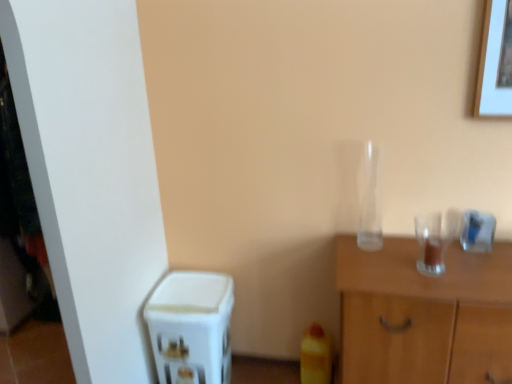
Question: Does transparent glass vase at center-right have a lesser height compared to white plastic water dispenser at lower left?

Choices:
 (A) yes
 (B) no

Answer: (A)

Question: From the image's perspective, is transparent glass vase at center-right over white plastic water dispenser at lower left?

Choices:
 (A) yes
 (B) no

Answer: (A)

Question: From a real-world perspective, is transparent glass vase at center-right over white plastic water dispenser at lower left?

Choices:
 (A) no
 (B) yes

Answer: (B)

Question: Is transparent glass vase at center-right wider than white plastic water dispenser at lower left?

Choices:
 (A) no
 (B) yes

Answer: (A)

Question: From the image's perspective, does transparent glass vase at center-right appear lower than white plastic water dispenser at lower left?

Choices:
 (A) no
 (B) yes

Answer: (A)

Question: In terms of height, does transparent glass vase at center-right look taller or shorter compared to white plastic water dispenser at lower left?

Choices:
 (A) short
 (B) tall

Answer: (A)

Question: From a real-world perspective, is transparent glass vase at center-right positioned above or below white plastic water dispenser at lower left?

Choices:
 (A) above
 (B) below

Answer: (A)

Question: Looking at their shapes, would you say transparent glass vase at center-right is wider or thinner than white plastic water dispenser at lower left?

Choices:
 (A) wide
 (B) thin

Answer: (B)

Question: Considering the relative positions of transparent glass vase at center-right and white plastic water dispenser at lower left in the image provided, is transparent glass vase at center-right to the left or to the right of white plastic water dispenser at lower left?

Choices:
 (A) left
 (B) right

Answer: (B)

Question: Relative to white plastic water dispenser at lower left, is transparent glass cabinet at right in front or behind?

Choices:
 (A) behind
 (B) front

Answer: (B)

Question: Based on their sizes in the image, would you say transparent glass cabinet at right is bigger or smaller than white plastic water dispenser at lower left?

Choices:
 (A) big
 (B) small

Answer: (A)

Question: Considering the positions of point [x=345, y=344] and point [x=162, y=377], is point [x=345, y=344] closer or farther from the camera than point [x=162, y=377]?

Choices:
 (A) farther
 (B) closer

Answer: (B)

Question: Would you say transparent glass cabinet at right is inside or outside white plastic water dispenser at lower left?

Choices:
 (A) outside
 (B) inside

Answer: (A)

Question: Is white plastic water dispenser at lower left bigger or smaller than transparent glass vase at center-right?

Choices:
 (A) small
 (B) big

Answer: (B)

Question: From their relative heights in the image, would you say white plastic water dispenser at lower left is taller or shorter than transparent glass vase at center-right?

Choices:
 (A) short
 (B) tall

Answer: (B)